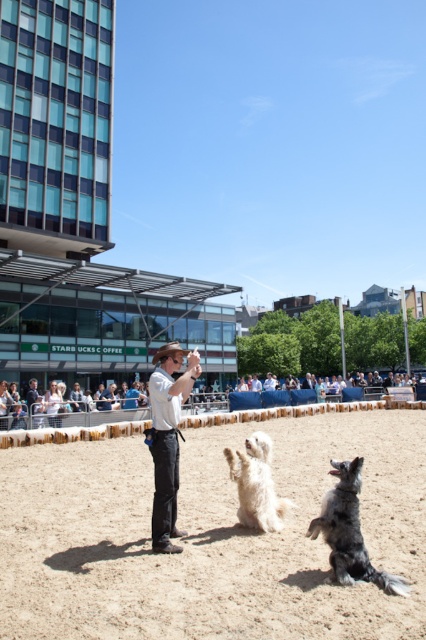
You are a photographer trying to capture a candid shot of the man directing the dogs. You notice a point at coordinates point (167,436). Based on the scene description, where is this point located on the man?

Answer: The point (167,436) is located on the white cotton shirt at center, which is part of the man directing the dogs.

You are a photographer standing at the position of the man. You want to take a photo of the silver metallic dog at center and the other dog. How far apart should you position the two dogs to ensure they are both in focus in the photo?

The silver metallic dog at center and the other dog are 4.13 meters apart. To ensure both are in focus, the photographer should maintain this distance or adjust the camera settings to have a sufficient depth of field.

In the scene shown: You are a photographer positioned to the side of the scene. You want to capture a closeup shot of the white cotton shirt at center and the brown leather cowboy hat at center in the same frame. Given that your camera has a maximum focus range of 35 inches, will you be able to achieve this shot without moving the subjects?

The white cotton shirt at center and brown leather cowboy hat at center are 35.71 inches apart from each other. Since the maximum focus range is 35 inches, the distance between them exceeds the camera limit. Therefore, you cannot capture both in focus without adjusting the subjects or using a different camera setting.